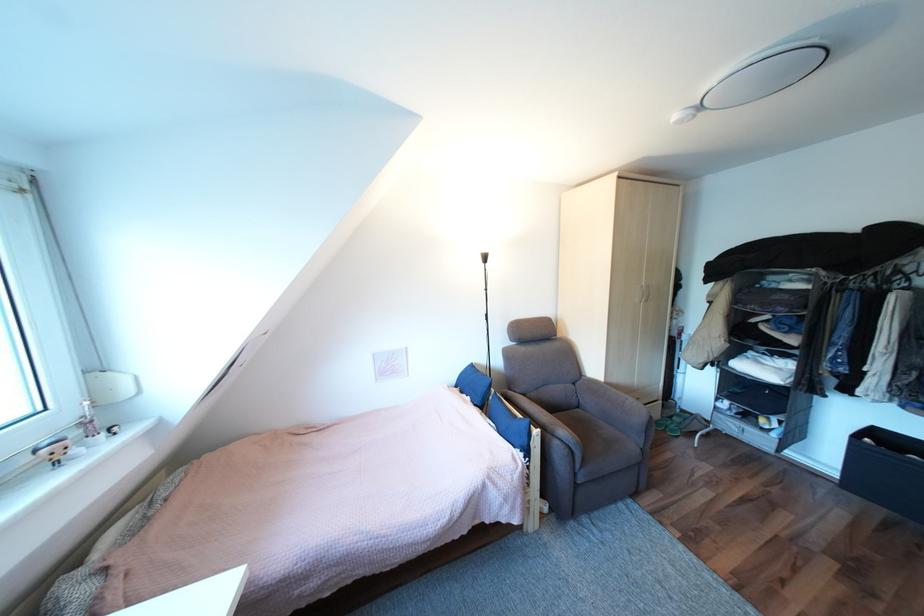
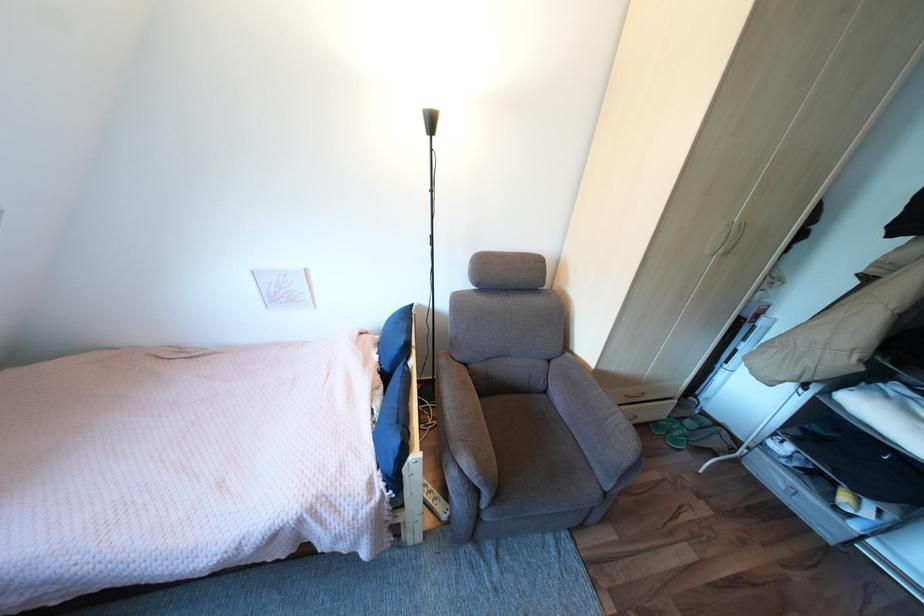
Question: Based on the continuous images, in which direction is the camera rotating? Reply with the corresponding letter.

Choices:
 (A) Left
 (B) Right
 (C) Up
 (D) Down

Answer: (D)